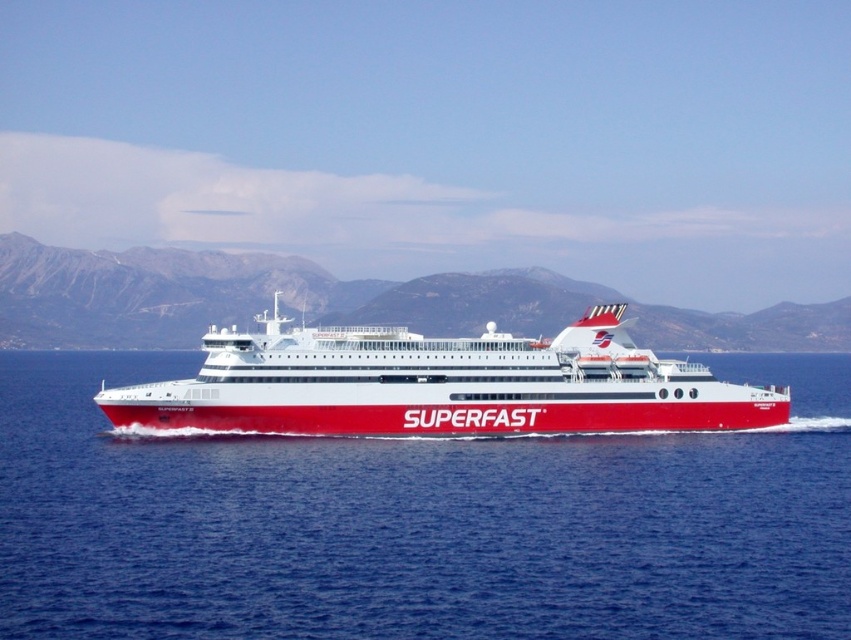
Looking at this image, you are standing at point (366,456) on the ferry named Superfast. You need to walk to the point that is 106.80 meters away from your current position. Is this distance longer than the length of the ferry itself?

The distance between the two points is 106.80 meters, which is longer than the length of the ferry itself.

You are a photographer on the ferry named Superfast. You want to capture a photo of the red glossy water at center and the gray rocky mountain at center. Which object appears narrower in the photo?

The red glossy water at center is thinner than the gray rocky mountain at center, so the red glossy water at center appears narrower in the photo.